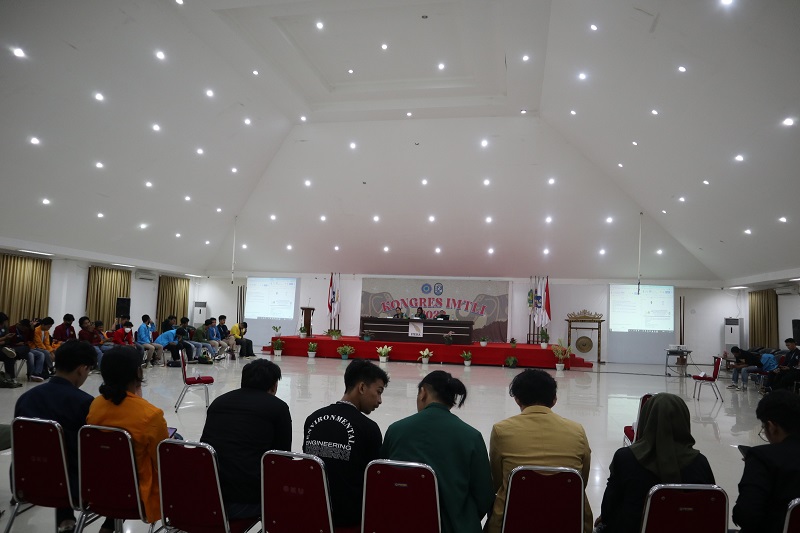
This screenshot has width=800, height=533. Find the location of `chair`. chair is located at coordinates (198, 379).